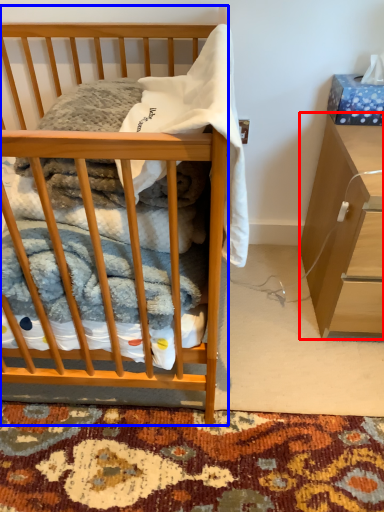
Question: Which object appears closest to the camera in this image, cabinetry (highlighted by a red box) or desk (highlighted by a blue box)?

Choices:
 (A) cabinetry
 (B) desk

Answer: (B)